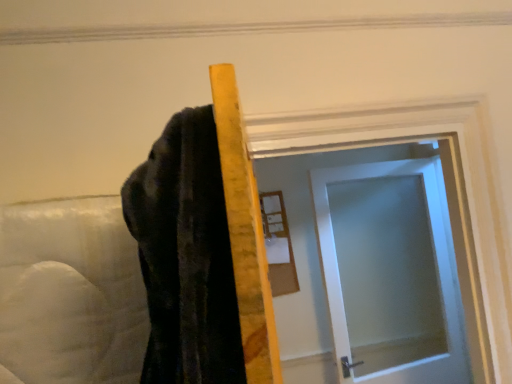
Question: Can you confirm if satin white door at center is positioned to the left of wooden framed mirror at upper center?

Choices:
 (A) no
 (B) yes

Answer: (A)

Question: Is wooden framed mirror at upper center at the back of satin white door at center?

Choices:
 (A) no
 (B) yes

Answer: (A)

Question: From a real-world perspective, is satin white door at center positioned under wooden framed mirror at upper center based on gravity?

Choices:
 (A) yes
 (B) no

Answer: (A)

Question: From the image's perspective, is satin white door at center below wooden framed mirror at upper center?

Choices:
 (A) yes
 (B) no

Answer: (A)

Question: From the image's perspective, is satin white door at center on wooden framed mirror at upper center?

Choices:
 (A) no
 (B) yes

Answer: (A)

Question: Does satin white door at center have a greater height compared to wooden framed mirror at upper center?

Choices:
 (A) no
 (B) yes

Answer: (B)

Question: Is wooden framed mirror at upper center thinner than satin white door at center?

Choices:
 (A) no
 (B) yes

Answer: (B)

Question: Does wooden framed mirror at upper center have a larger size compared to satin white door at center?

Choices:
 (A) yes
 (B) no

Answer: (B)

Question: Would you say wooden framed mirror at upper center is outside satin white door at center?

Choices:
 (A) yes
 (B) no

Answer: (A)

Question: Considering the relative positions of wooden framed mirror at upper center and satin white door at center in the image provided, is wooden framed mirror at upper center behind satin white door at center?

Choices:
 (A) yes
 (B) no

Answer: (A)

Question: From a real-world perspective, is wooden framed mirror at upper center positioned under satin white door at center based on gravity?

Choices:
 (A) no
 (B) yes

Answer: (A)

Question: Considering the relative sizes of wooden framed mirror at upper center and satin white door at center in the image provided, is wooden framed mirror at upper center taller than satin white door at center?

Choices:
 (A) no
 (B) yes

Answer: (A)

Question: Based on their sizes in the image, would you say satin white door at center is bigger or smaller than wooden framed mirror at upper center?

Choices:
 (A) small
 (B) big

Answer: (B)